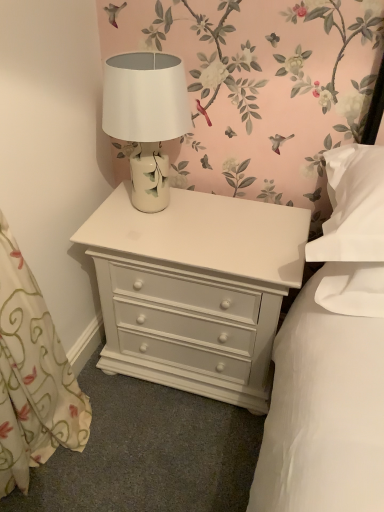
At what (x,y) coordinates should I click in order to perform the action: click on vacant space to the right of white ceramic table lamp at center. Please return your answer as a coordinate pair (x, y). Looking at the image, I should click on tap(229, 218).